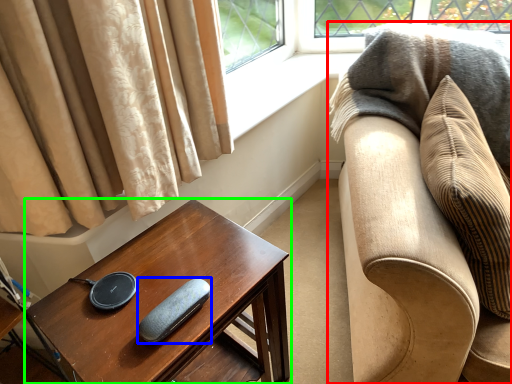
Question: Considering the real-world distances, which object is closest to studio couch (highlighted by a red box)? pad (highlighted by a blue box) or table (highlighted by a green box).

Choices:
 (A) pad
 (B) table

Answer: (B)